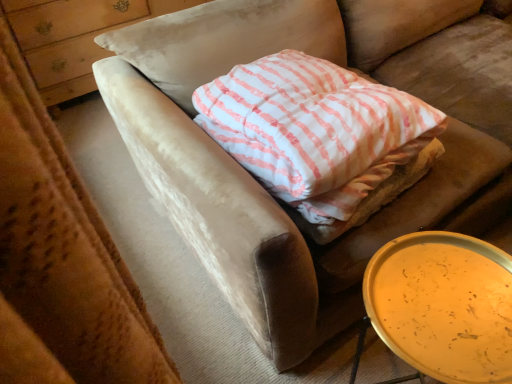
Question: Is the depth of metallic gold tray at lower right less than that of wooden dresser at upper left?

Choices:
 (A) yes
 (B) no

Answer: (A)

Question: Is metallic gold tray at lower right not close to wooden dresser at upper left?

Choices:
 (A) no
 (B) yes

Answer: (B)

Question: From a real-world perspective, is metallic gold tray at lower right located higher than wooden dresser at upper left?

Choices:
 (A) no
 (B) yes

Answer: (A)

Question: From a real-world perspective, is metallic gold tray at lower right below wooden dresser at upper left?

Choices:
 (A) yes
 (B) no

Answer: (A)

Question: Does metallic gold tray at lower right have a smaller size compared to wooden dresser at upper left?

Choices:
 (A) no
 (B) yes

Answer: (B)

Question: In the image, is metallic gold tray at lower right positioned in front of or behind white striped fabric pillow at center?

Choices:
 (A) front
 (B) behind

Answer: (A)

Question: From their relative heights in the image, would you say metallic gold tray at lower right is taller or shorter than white striped fabric pillow at center?

Choices:
 (A) short
 (B) tall

Answer: (B)

Question: From a real-world perspective, is metallic gold tray at lower right physically located above or below white striped fabric pillow at center?

Choices:
 (A) above
 (B) below

Answer: (B)

Question: Is metallic gold tray at lower right to the left or to the right of white striped fabric pillow at center in the image?

Choices:
 (A) left
 (B) right

Answer: (B)

Question: In terms of size, does white striped fabric pillow at center appear bigger or smaller than metallic gold tray at lower right?

Choices:
 (A) small
 (B) big

Answer: (B)

Question: Considering the positions of white striped fabric pillow at center and metallic gold tray at lower right in the image, is white striped fabric pillow at center taller or shorter than metallic gold tray at lower right?

Choices:
 (A) short
 (B) tall

Answer: (A)

Question: Is white striped fabric pillow at center in front of or behind metallic gold tray at lower right in the image?

Choices:
 (A) front
 (B) behind

Answer: (B)

Question: In terms of width, does white striped fabric pillow at center look wider or thinner when compared to metallic gold tray at lower right?

Choices:
 (A) wide
 (B) thin

Answer: (A)

Question: Considering the positions of wooden dresser at upper left and metallic gold tray at lower right in the image, is wooden dresser at upper left wider or thinner than metallic gold tray at lower right?

Choices:
 (A) thin
 (B) wide

Answer: (B)

Question: In terms of height, does wooden dresser at upper left look taller or shorter compared to metallic gold tray at lower right?

Choices:
 (A) tall
 (B) short

Answer: (A)